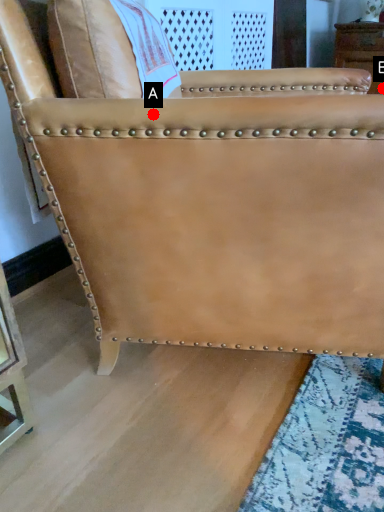
Question: Two points are circled on the image, labeled by A and B beside each circle. Which point is farther from the camera taking this photo?

Choices:
 (A) A is further
 (B) B is further

Answer: (B)